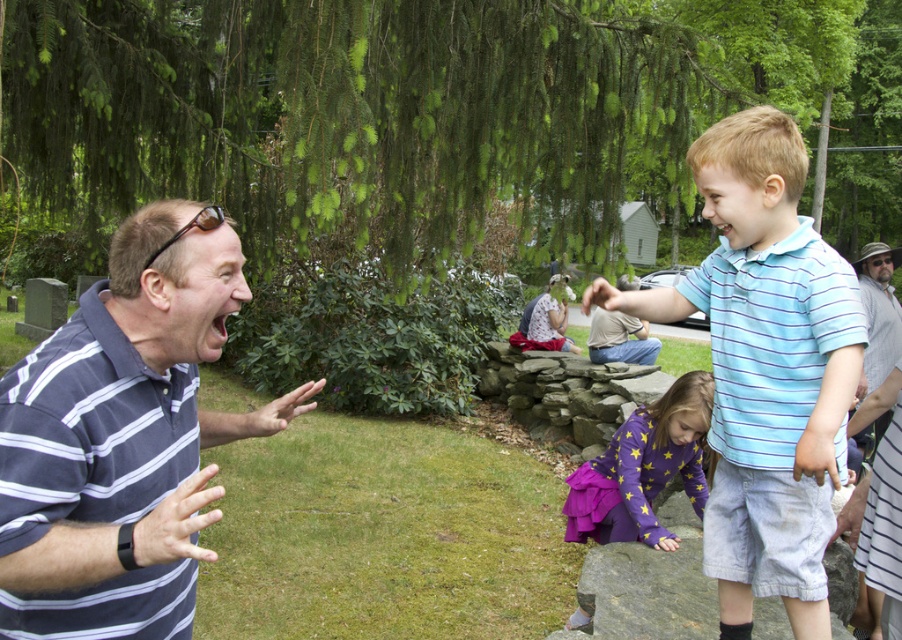
Question: Does purple satin dress at lower center have a greater width compared to gray cotton shirt at upper right?

Choices:
 (A) no
 (B) yes

Answer: (A)

Question: Estimate the real-world distances between objects in this image. Which object is farther from the light blue striped polo shirt at right?

Choices:
 (A) gray cotton shirt at upper right
 (B) purple satin dress at lower center

Answer: (B)

Question: Does dark gray striped polo shirt at left appear under purple satin dress at lower center?

Choices:
 (A) yes
 (B) no

Answer: (B)

Question: Which point is farther from the camera taking this photo?

Choices:
 (A) (587, 499)
 (B) (890, 340)
 (C) (808, 525)

Answer: (B)

Question: Among these objects, which one is farthest from the camera?

Choices:
 (A) gray cotton shirt at upper right
 (B) light blue striped polo shirt at right
 (C) dark gray striped polo shirt at left

Answer: (A)

Question: Can you confirm if purple satin dress at lower center is thinner than gray cotton shirt at upper right?

Choices:
 (A) yes
 (B) no

Answer: (A)